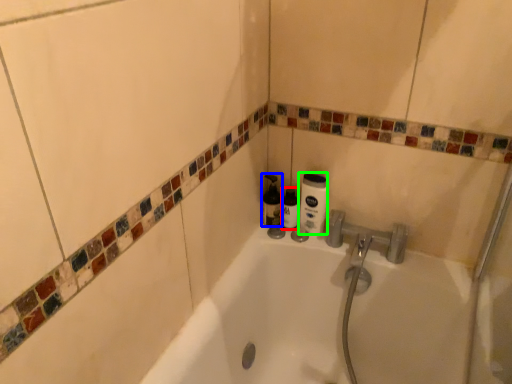
Question: Which is farther away from toiletry (highlighted by a red box)? bottle (highlighted by a blue box) or cleaning product (highlighted by a green box)?

Choices:
 (A) bottle
 (B) cleaning product

Answer: (B)